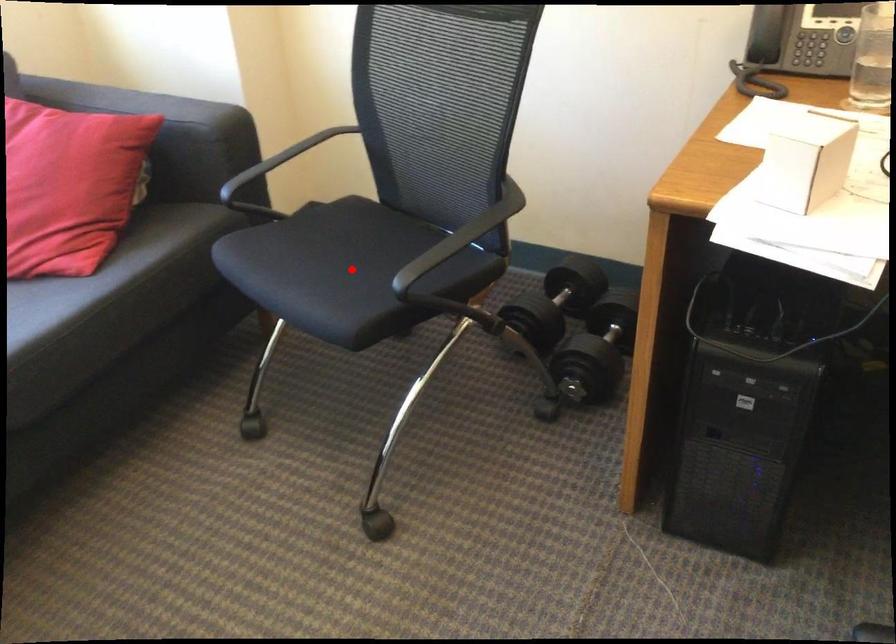
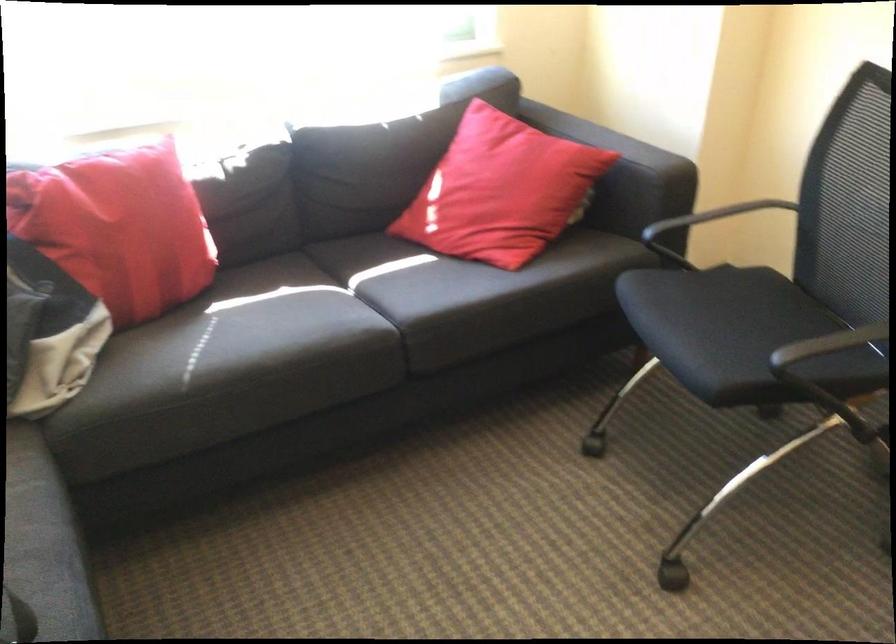
Question: I am providing you with two images of the same scene from different viewpoints. A red point is marked on the first image. Is the red point's position out of view in image 2?

Choices:
 (A) Yes
 (B) No

Answer: (B)